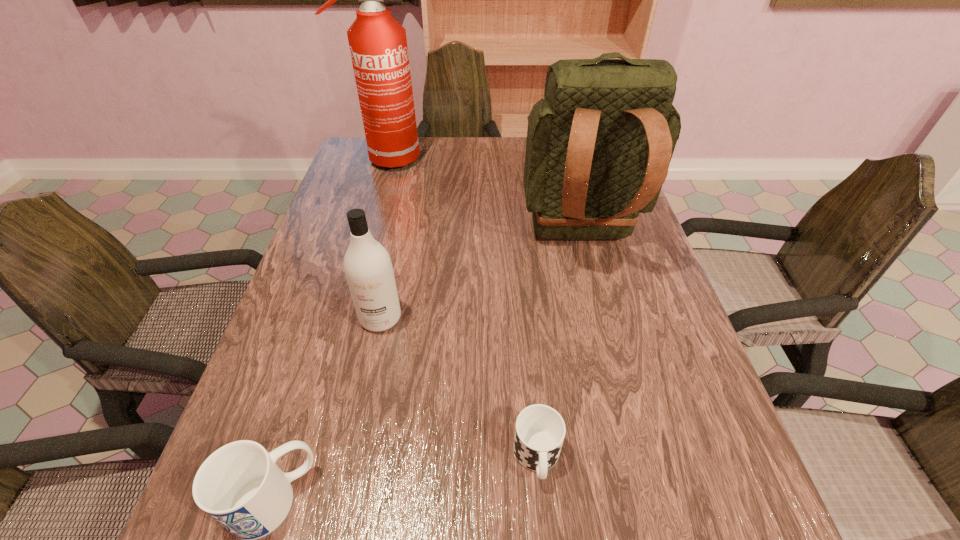
What are the coordinates of `fire extinguisher` in the screenshot? It's located at (378, 45).

Where is `the tallest object`? This screenshot has height=540, width=960. the tallest object is located at coordinates (378, 45).

You are a GUI agent. You are given a task and a screenshot of the screen. Output one action in this format:
    pyautogui.click(x=<x>, y=<y>)
    Task: Click on the second tallest object
    The height and width of the screenshot is (540, 960).
    Given the screenshot: What is the action you would take?
    pyautogui.click(x=599, y=145)

Where is `the second farthest object`? The height and width of the screenshot is (540, 960). the second farthest object is located at coordinates (599, 145).

I want to click on the third nearest object, so click(x=368, y=269).

Find the location of a particular element. Image resolution: width=960 pixels, height=540 pixels. shampoo is located at coordinates (368, 269).

Where is `cup`? cup is located at coordinates (540, 430).

This screenshot has width=960, height=540. What are the coordinates of `blank space located 0.370m at the nozzle of the fire extinguisher` in the screenshot? It's located at (x=536, y=160).

Identify the location of vacant position located 0.400m on the back of the second farthest object. (635, 450).

The width and height of the screenshot is (960, 540). In order to click on vacant region located on the front-facing side of the third nearest object in this screenshot , I will do `click(353, 447)`.